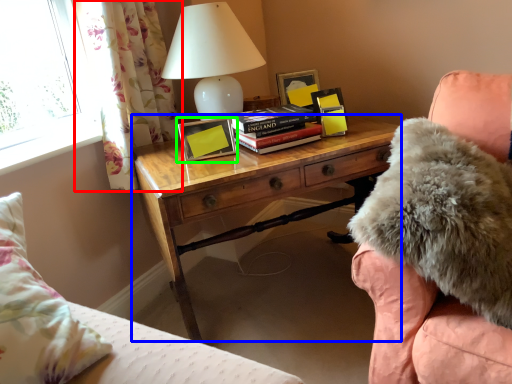
Question: Considering the real-world distances, which object is closest to curtain (highlighted by a red box)? nightstand (highlighted by a blue box) or picture frame (highlighted by a green box).

Choices:
 (A) nightstand
 (B) picture frame

Answer: (B)